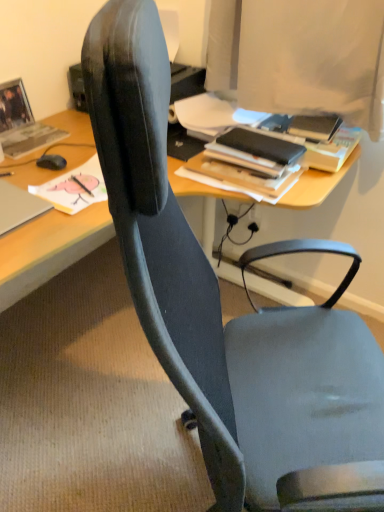
Image resolution: width=384 pixels, height=512 pixels. What do you see at coordinates (74, 188) in the screenshot?
I see `matte black book at upper left, the second book positioned from the left` at bounding box center [74, 188].

Identify the location of black matte book at upper right, the 3th book viewed from the left. The image size is (384, 512). (240, 176).

What is the approximate height of black matte mouse at left?

The height of black matte mouse at left is 1.73 inches.

Where is `matte black book at upper left, the second book positioned from the left`? matte black book at upper left, the second book positioned from the left is located at coordinates (74, 188).

Considering the sizes of matte gray book at upper left, arranged as the 3th book when viewed from the right, and black matte mouse at left in the image, is matte gray book at upper left, arranged as the 3th book when viewed from the right, taller or shorter than black matte mouse at left?

Considering their sizes, matte gray book at upper left, arranged as the 3th book when viewed from the right, has less height than black matte mouse at left.

Based on their sizes in the image, would you say matte gray book at upper left, the first book in the left-to-right sequence, is bigger or smaller than black matte mouse at left?

Considering their sizes, matte gray book at upper left, the first book in the left-to-right sequence, takes up more space than black matte mouse at left.

Is matte gray book at upper left, the first book in the left-to-right sequence, facing away from black matte mouse at left?

No, black matte mouse at left is not at the back of matte gray book at upper left, the first book in the left-to-right sequence.

From the image's perspective, is matte gray book at upper left, arranged as the 3th book when viewed from the right, beneath black matte book at upper right, the first book from the right?

Incorrect, from the image's perspective, matte gray book at upper left, arranged as the 3th book when viewed from the right, is higher than black matte book at upper right, the first book from the right.

Is matte gray book at upper left, the first book in the left-to-right sequence, aimed at black matte book at upper right, the 3th book viewed from the left?

Yes, matte gray book at upper left, the first book in the left-to-right sequence, is facing black matte book at upper right, the 3th book viewed from the left.

Considering the relative positions of matte gray book at upper left, the first book in the left-to-right sequence, and black matte book at upper right, the 3th book viewed from the left, in the image provided, is matte gray book at upper left, the first book in the left-to-right sequence, to the left of black matte book at upper right, the 3th book viewed from the left, from the viewer's perspective?

Correct, you'll find matte gray book at upper left, the first book in the left-to-right sequence, to the left of black matte book at upper right, the 3th book viewed from the left.

Consider the image. Which object is positioned more to the right, matte black book at upper left, positioned as the 2th book in right-to-left order, or matte gray book at upper left, arranged as the 3th book when viewed from the right?

Positioned to the right is matte black book at upper left, positioned as the 2th book in right-to-left order.

Is matte black book at upper left, positioned as the 2th book in right-to-left order, oriented away from matte gray book at upper left, the first book in the left-to-right sequence?

That's right, matte black book at upper left, positioned as the 2th book in right-to-left order, is facing away from matte gray book at upper left, the first book in the left-to-right sequence.

Is matte black book at upper left, the second book positioned from the left, situated inside matte gray book at upper left, the first book in the left-to-right sequence, or outside?

matte black book at upper left, the second book positioned from the left, lies outside matte gray book at upper left, the first book in the left-to-right sequence.

Would you say matte black book at upper left, positioned as the 2th book in right-to-left order, is outside black matte book at upper right, the 3th book viewed from the left?

matte black book at upper left, positioned as the 2th book in right-to-left order, lies outside black matte book at upper right, the 3th book viewed from the left,'s area.

Between matte black book at upper left, the second book positioned from the left, and black matte book at upper right, the 3th book viewed from the left, which one is positioned behind?

black matte book at upper right, the 3th book viewed from the left.

From a real-world perspective, between matte black book at upper left, positioned as the 2th book in right-to-left order, and black matte book at upper right, the 3th book viewed from the left, who is vertically lower?

In real-world perspective, matte black book at upper left, positioned as the 2th book in right-to-left order, is lower.

Is black matte mouse at left at the back of matte black book at upper left, positioned as the 2th book in right-to-left order?

That's right, matte black book at upper left, positioned as the 2th book in right-to-left order, is facing away from black matte mouse at left.

Image resolution: width=384 pixels, height=512 pixels. Find the location of `the 1st book counting from the right side of the black matte mouse at left`. the 1st book counting from the right side of the black matte mouse at left is located at coordinates (74, 188).

Consider the image. From the image's perspective, is matte black book at upper left, the second book positioned from the left, under black matte mouse at left?

Correct, matte black book at upper left, the second book positioned from the left, appears lower than black matte mouse at left in the image.

From the picture: Is matte black book at upper left, the second book positioned from the left, closer to the viewer compared to black matte mouse at left?

Yes, matte black book at upper left, the second book positioned from the left, is closer to the viewer.

Considering the points (54, 166) and (259, 198), which point is behind, point (54, 166) or point (259, 198)?

Positioned behind is point (54, 166).

Considering their positions, is black matte mouse at left located in front of or behind black matte book at upper right, the 3th book viewed from the left?

In the image, black matte mouse at left appears behind black matte book at upper right, the 3th book viewed from the left.

Is black matte mouse at left oriented away from black matte book at upper right, the first book from the right?

black matte mouse at left is not turned away from black matte book at upper right, the first book from the right.

From the picture: From a real-world perspective, who is located lower, black matte mouse at left or black matte book at upper right, the 3th book viewed from the left?

black matte mouse at left, from a real-world perspective.

Does black matte mouse at left have a lesser height compared to matte black book at upper left, positioned as the 2th book in right-to-left order?

In fact, black matte mouse at left may be taller than matte black book at upper left, positioned as the 2th book in right-to-left order.

How many degrees apart are the facing directions of black matte mouse at left and matte black book at upper left, positioned as the 2th book in right-to-left order?

They differ by 0.00456 degrees in their facing directions.

Is black matte mouse at left looking in the opposite direction of matte black book at upper left, the second book positioned from the left?

black matte mouse at left is not turned away from matte black book at upper left, the second book positioned from the left.

In the image, is black matte mouse at left positioned in front of or behind matte black book at upper left, the second book positioned from the left?

In the image, black matte mouse at left appears behind matte black book at upper left, the second book positioned from the left.

You are a GUI agent. You are given a task and a screenshot of the screen. Output one action in this format:
    pyautogui.click(x=<x>, y=<y>)
    Task: Click on the book on the left of black matte mouse at left
    
    Given the screenshot: What is the action you would take?
    pyautogui.click(x=29, y=139)

This screenshot has height=512, width=384. Identify the location of book located behind the black matte book at upper right, the first book from the right. (29, 139).

From the image, which object appears to be farther from matte gray book at upper left, the first book in the left-to-right sequence, black matte mouse at left or black matte book at upper right, the 3th book viewed from the left?

black matte book at upper right, the 3th book viewed from the left, is positioned further to the anchor matte gray book at upper left, the first book in the left-to-right sequence.

Estimate the real-world distances between objects in this image. Which object is further from matte gray book at upper left, arranged as the 3th book when viewed from the right, matte black book at upper left, positioned as the 2th book in right-to-left order, or black matte mouse at left?

matte black book at upper left, positioned as the 2th book in right-to-left order, is positioned further to the anchor matte gray book at upper left, arranged as the 3th book when viewed from the right.

Based on the photo, considering their positions, is matte black book at upper left, the second book positioned from the left, positioned further to matte gray book at upper left, the first book in the left-to-right sequence, than black matte book at upper right, the 3th book viewed from the left?

black matte book at upper right, the 3th book viewed from the left, lies further to matte gray book at upper left, the first book in the left-to-right sequence, than the other object.

Looking at the image, which one is located further to black matte book at upper right, the first book from the right, matte black book at upper left, positioned as the 2th book in right-to-left order, or matte gray book at upper left, the first book in the left-to-right sequence?

The object further to black matte book at upper right, the first book from the right, is matte gray book at upper left, the first book in the left-to-right sequence.

When comparing their distances from black matte mouse at left, does matte black book at upper left, the second book positioned from the left, or matte gray book at upper left, arranged as the 3th book when viewed from the right, seem further?

Based on the image, matte gray book at upper left, arranged as the 3th book when viewed from the right, appears to be further to black matte mouse at left.

Based on the photo, which object lies further to the anchor point matte black book at upper left, the second book positioned from the left, black matte mouse at left or matte gray book at upper left, the first book in the left-to-right sequence?

matte gray book at upper left, the first book in the left-to-right sequence, lies further to matte black book at upper left, the second book positioned from the left, than the other object.

Based on their spatial positions, is black matte book at upper right, the 3th book viewed from the left, or matte gray book at upper left, the first book in the left-to-right sequence, further from matte black book at upper left, positioned as the 2th book in right-to-left order?

black matte book at upper right, the 3th book viewed from the left.

Considering their positions, is black matte book at upper right, the first book from the right, positioned further to matte gray book at upper left, arranged as the 3th book when viewed from the right, than matte black book at upper left, positioned as the 2th book in right-to-left order?

Among the two, black matte book at upper right, the first book from the right, is located further to matte gray book at upper left, arranged as the 3th book when viewed from the right.

Locate an element on the screen. This screenshot has height=512, width=384. mouse between matte gray book at upper left, the first book in the left-to-right sequence, and matte black book at upper left, positioned as the 2th book in right-to-left order, in the horizontal direction is located at coordinates (51, 162).

Locate an element on the screen. The height and width of the screenshot is (512, 384). mouse between matte gray book at upper left, the first book in the left-to-right sequence, and black matte book at upper right, the first book from the right, in the horizontal direction is located at coordinates (51, 162).

Locate an element on the screen. This screenshot has height=512, width=384. book between matte gray book at upper left, arranged as the 3th book when viewed from the right, and black matte book at upper right, the 3th book viewed from the left, from left to right is located at coordinates (74, 188).

The width and height of the screenshot is (384, 512). I want to click on book between black matte mouse at left and black matte book at upper right, the 3th book viewed from the left, so click(x=74, y=188).